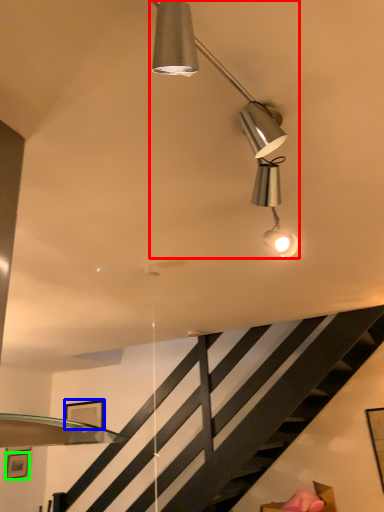
Question: Which is farther away from lamp (highlighted by a red box)? picture frame (highlighted by a blue box) or picture frame (highlighted by a green box)?

Choices:
 (A) picture frame
 (B) picture frame

Answer: (B)